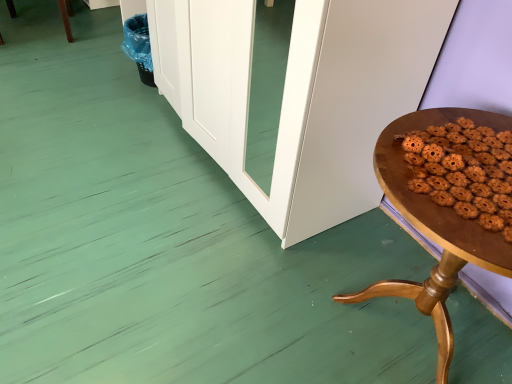
This screenshot has width=512, height=384. In order to click on vacant space underneath wooden table at right (from a real-world perspective) in this screenshot , I will do `click(407, 326)`.